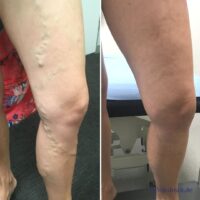
I want to click on red cloth, so click(13, 71).